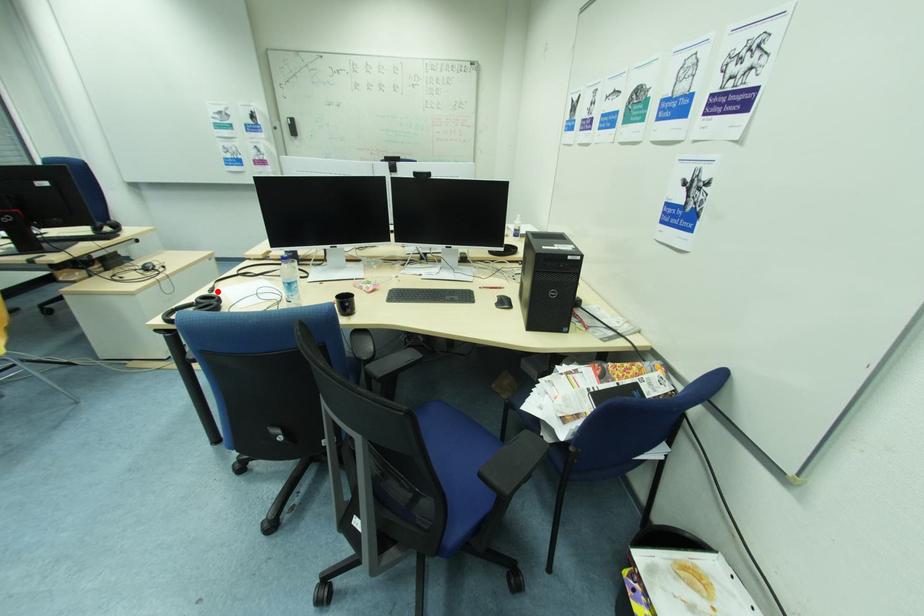
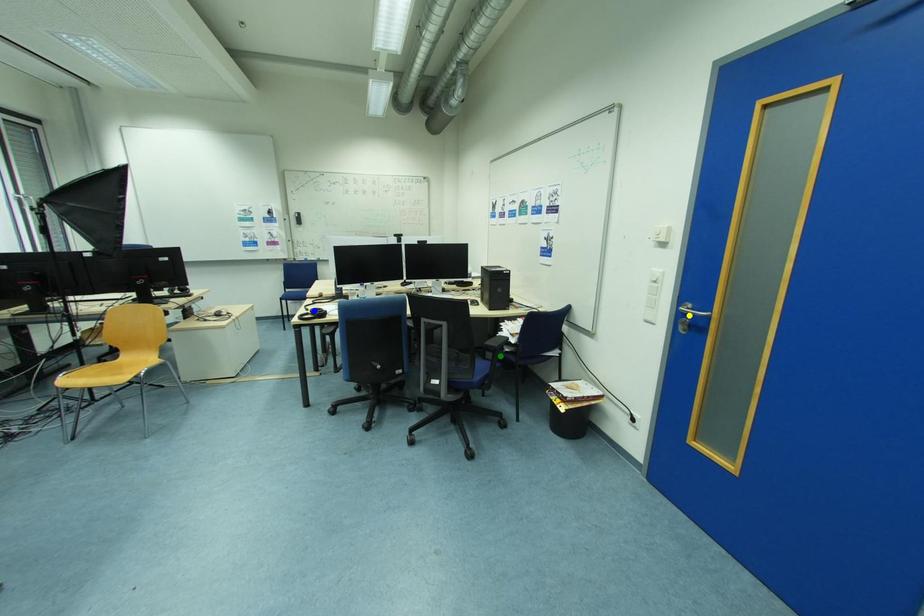
Question: I am providing you with two images of the same scene from different viewpoints. A red point is marked on the first image. You are given multiple points on the second image. Which point in image 2 represents the same 3d spot as the red point in image 1?

Choices:
 (A) green point
 (B) blue point
 (C) yellow point

Answer: (B)